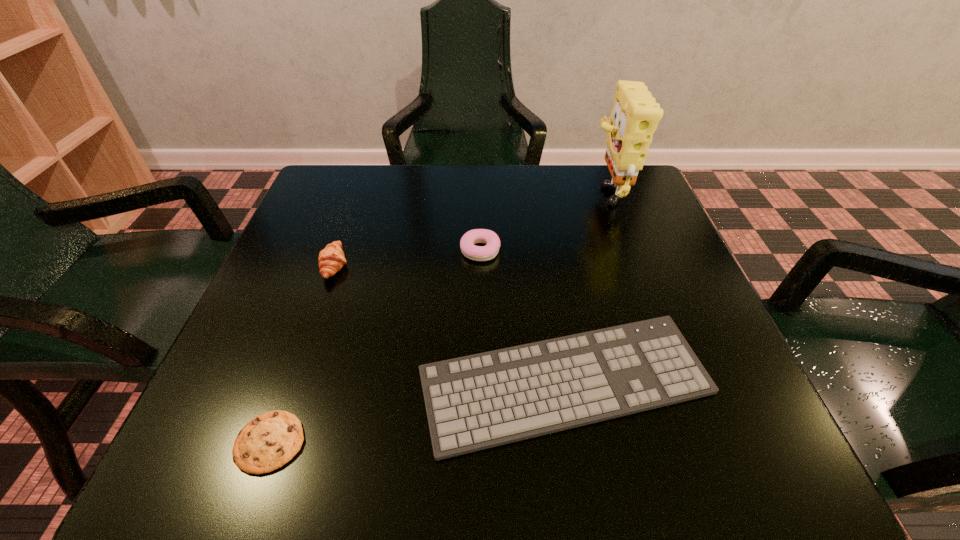
Identify the location of vacant area that lies between the third shortest object and the fourth tallest object. The image size is (960, 540). (523, 316).

Where is `object that is the fourth closest to the second shortest object`? The image size is (960, 540). object that is the fourth closest to the second shortest object is located at coordinates (635, 115).

Identify the location of object that is the third nearest to the cookie. Image resolution: width=960 pixels, height=540 pixels. (477, 253).

Locate an element on the screen. The image size is (960, 540). free space that satisfies the following two spatial constraints: 1. on the front-facing side of the computer keyboard; 2. on the right side of the taller pastry is located at coordinates click(x=293, y=383).

Identify the location of vacant region that satisfies the following two spatial constraints: 1. on the front side of the shorter pastry; 2. on the right side of the second shortest object. click(x=480, y=383).

This screenshot has width=960, height=540. What are the coordinates of `free space that satisfies the following two spatial constraints: 1. on the back side of the cookie; 2. on the left side of the computer keyboard` in the screenshot? It's located at (291, 383).